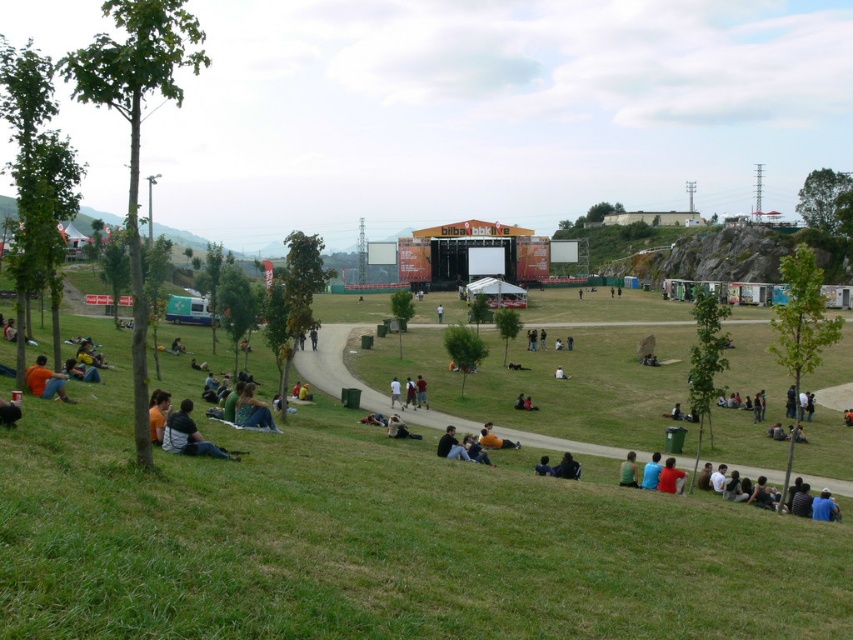
Question: Does green fabric jacket at lower left appear on the right side of red shirt at lower right?

Choices:
 (A) no
 (B) yes

Answer: (A)

Question: From the image, what is the correct spatial relationship of green fabric at lower right in relation to dark blue jeans at center?

Choices:
 (A) below
 (B) above

Answer: (A)

Question: Which is nearer to the dark gray fabric jacket at lower left?

Choices:
 (A) blue fabric shirt at lower right
 (B) light brown leather jacket at center
 (C) green fabric jacket at lower left

Answer: (C)

Question: Which point is closer to the camera?

Choices:
 (A) (399, 387)
 (B) (260, 420)

Answer: (B)

Question: Which point is farther to the camera?

Choices:
 (A) (648, 461)
 (B) (57, 385)

Answer: (A)

Question: Does orange t-shirt at lower left appear under orange fabric shirt at lower left?

Choices:
 (A) no
 (B) yes

Answer: (A)